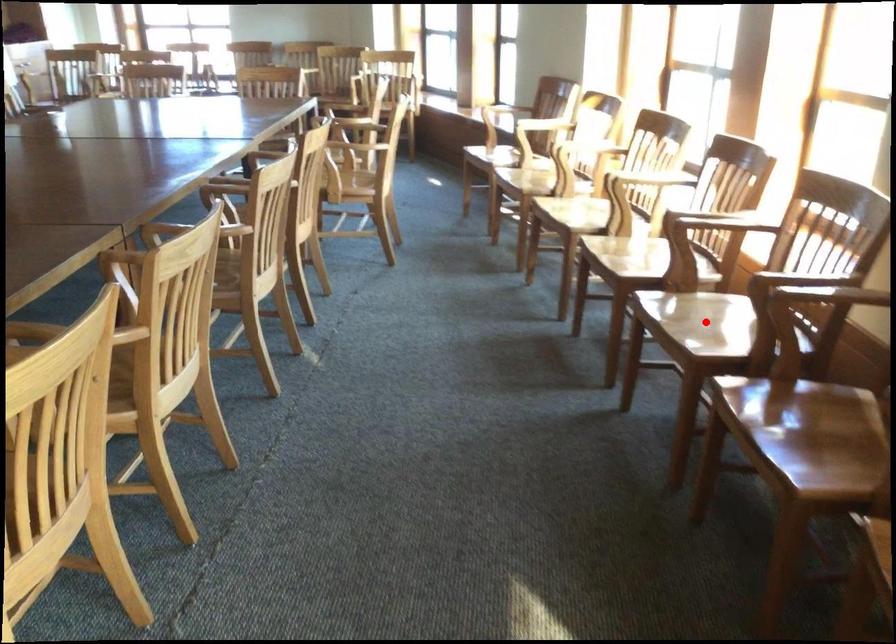
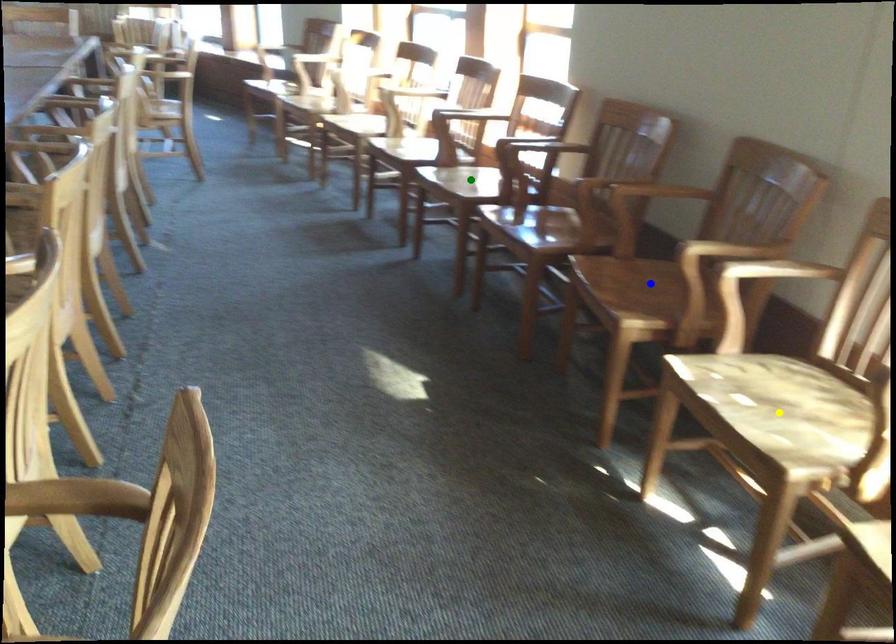
Question: I am providing you with two images of the same scene from different viewpoints. A red point is marked on the first image. You are given multiple points on the second image. Can you choose the point in image 2 that corresponds to the point in image 1?

Choices:
 (A) blue point
 (B) yellow point
 (C) green point

Answer: (C)